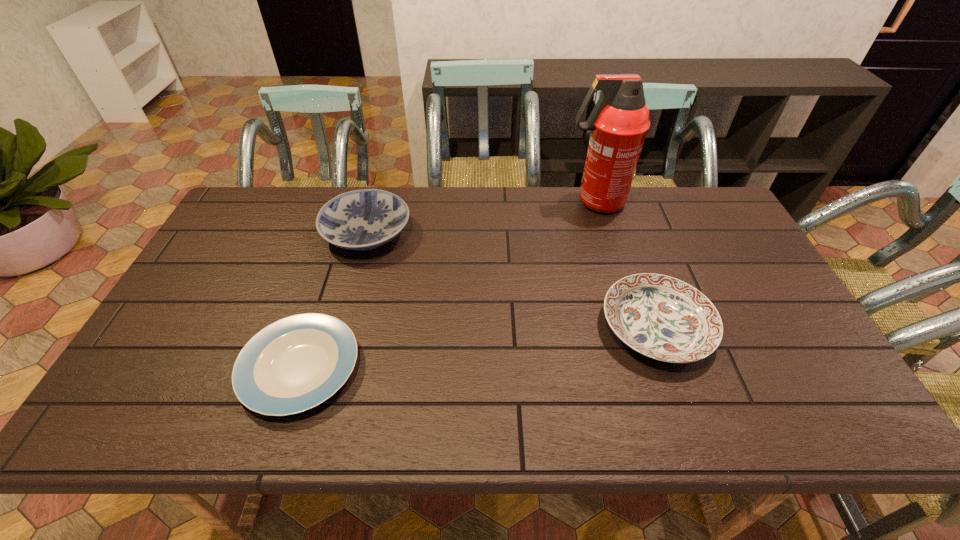
Locate an element on the screen. This screenshot has height=540, width=960. fire extinguisher is located at coordinates (619, 122).

I want to click on the tallest plate, so click(x=365, y=219).

I want to click on the third shortest object, so click(365, 219).

Identify the location of the third tallest object. The height and width of the screenshot is (540, 960). (661, 317).

Where is `the second tallest plate`? The image size is (960, 540). the second tallest plate is located at coordinates (661, 317).

Image resolution: width=960 pixels, height=540 pixels. What are the coordinates of `the shortest object` in the screenshot? It's located at click(296, 363).

The image size is (960, 540). I want to click on vacant point located on the trigger side of the fire extinguisher, so click(455, 202).

Find the location of `free space located on the trigger side of the fire extinguisher`. free space located on the trigger side of the fire extinguisher is located at coordinates (449, 202).

Where is `vacant space located 0.100m on the trigger side of the fire extinguisher`? vacant space located 0.100m on the trigger side of the fire extinguisher is located at coordinates point(535,202).

Identify the location of vacant space situated 0.110m on the back of the tallest plate. The height and width of the screenshot is (540, 960). (379, 188).